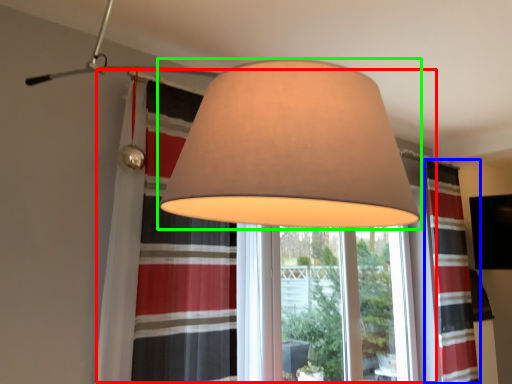
Question: Which object is the closest to the bay window (highlighted by a red box)? Choose among these: curtain (highlighted by a blue box) or lamp (highlighted by a green box).

Choices:
 (A) curtain
 (B) lamp

Answer: (B)